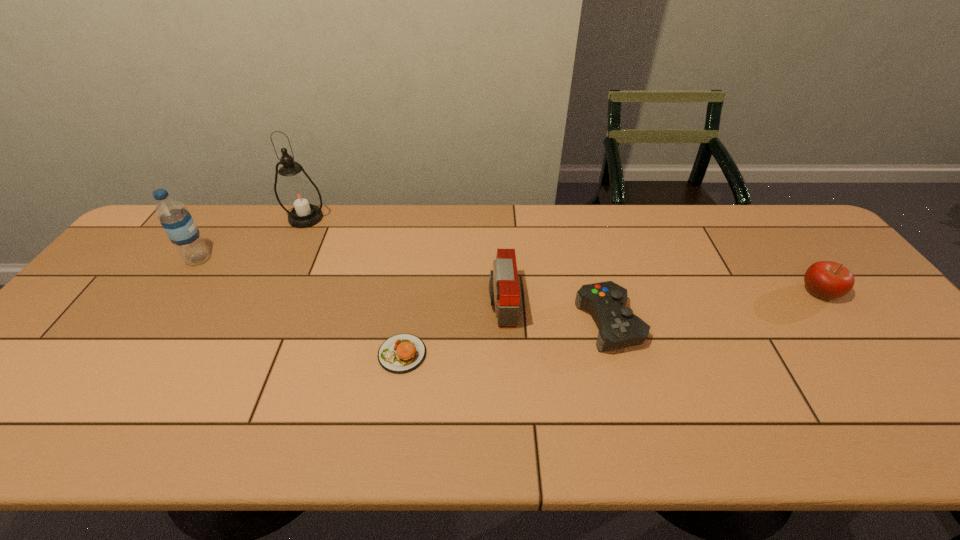
Identify the location of the fourth object from right to left. The height and width of the screenshot is (540, 960). (x=402, y=353).

Identify the location of patty. The image size is (960, 540). (402, 353).

In order to click on vacant space located 0.180m on the left of the second object from left to right in this screenshot , I will do `click(229, 218)`.

The height and width of the screenshot is (540, 960). What are the coordinates of `free location located 0.130m on the label of the fifth shortest object` in the screenshot? It's located at (255, 259).

Identify the location of blank space located 0.100m on the front-facing side of the third tallest object. The height and width of the screenshot is (540, 960). (450, 303).

Locate an element on the screen. free region located 0.230m on the front-facing side of the third tallest object is located at coordinates (402, 303).

The image size is (960, 540). I want to click on free location located on the front-facing side of the third tallest object, so click(346, 303).

The height and width of the screenshot is (540, 960). Identify the location of blank area located on the front of the fourth tallest object. (910, 409).

Where is `vacant space located 0.180m on the back of the control`? vacant space located 0.180m on the back of the control is located at coordinates (589, 251).

The image size is (960, 540). Identify the location of free space located on the back of the patty. (415, 272).